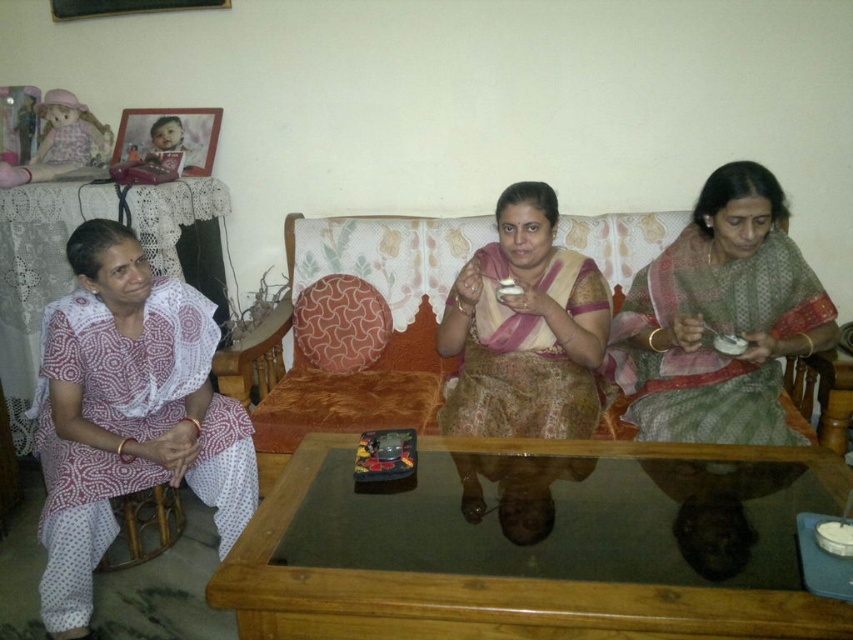
You are standing in the living room and want to place a decorative pillow on the sofa. The sofa has a specific spot marked at coordinates point 0.647, 0.150. Where should you place the pillow to align with the white printed fabric at left?

The white printed fabric at left is positioned at point (126, 413), so you should place the decorative pillow at that exact coordinate to align with it.

You are a tailor who needs to determine which of the two saris, the green woven sari at center or the matte pink saree at center, requires more fabric for alterations. Based on their sizes in the image, which one would need more fabric?

The green woven sari at center requires more fabric for alterations because its width surpasses that of the matte pink saree at center.